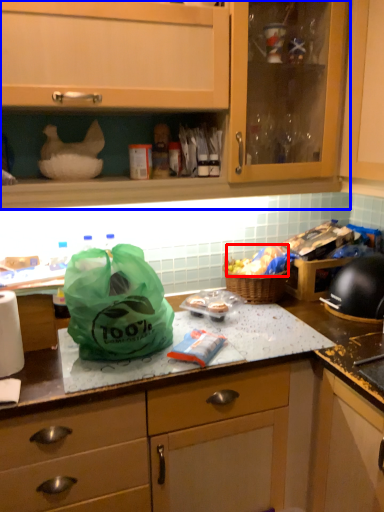
Question: Which object appears farthest to the camera in this image, food (highlighted by a red box) or cabinetry (highlighted by a blue box)?

Choices:
 (A) food
 (B) cabinetry

Answer: (A)